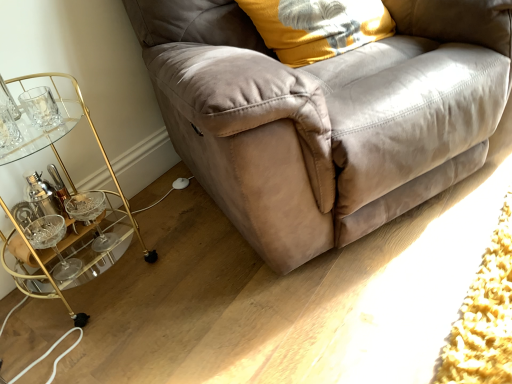
Locate an element on the screen. soft yellow fabric pillow at upper right is located at coordinates (317, 27).

This screenshot has height=384, width=512. Describe the element at coordinates (326, 116) in the screenshot. I see `suede couch at center` at that location.

Locate an element on the screen. The image size is (512, 384). soft yellow fabric pillow at upper right is located at coordinates (317, 27).

What's the angular difference between gold metallic bar cart at left and soft yellow fabric pillow at upper right's facing directions?

The angle between the facing direction of gold metallic bar cart at left and the facing direction of soft yellow fabric pillow at upper right is 25.6 degrees.

Who is smaller, gold metallic bar cart at left or soft yellow fabric pillow at upper right?

With smaller size is soft yellow fabric pillow at upper right.

From a real-world perspective, which is physically below, gold metallic bar cart at left or soft yellow fabric pillow at upper right?

gold metallic bar cart at left, from a real-world perspective.

Is gold metallic bar cart at left oriented towards soft yellow fabric pillow at upper right?

No.

The width and height of the screenshot is (512, 384). In order to click on pillow above the gold metallic bar cart at left (from a real-world perspective) in this screenshot , I will do `click(317, 27)`.

Considering the sizes of objects soft yellow fabric pillow at upper right and gold metallic bar cart at left in the image provided, who is shorter, soft yellow fabric pillow at upper right or gold metallic bar cart at left?

With less height is soft yellow fabric pillow at upper right.

How different are the orientations of soft yellow fabric pillow at upper right and gold metallic bar cart at left in degrees?

25.6 degrees.

From the image's perspective, is soft yellow fabric pillow at upper right under gold metallic bar cart at left?

Incorrect, from the image's perspective, soft yellow fabric pillow at upper right is higher than gold metallic bar cart at left.

Find the location of a particular element. studio couch located above the gold metallic bar cart at left (from the image's perspective) is located at coordinates (326, 116).

In the scene shown: Is suede couch at center spatially inside gold metallic bar cart at left, or outside of it?

suede couch at center is located beyond the bounds of gold metallic bar cart at left.

Who is bigger, suede couch at center or gold metallic bar cart at left?

suede couch at center is bigger.

Can you tell me how much suede couch at center and gold metallic bar cart at left differ in facing direction?

24.4 degrees.

From the image's perspective, relative to suede couch at center, is gold metallic bar cart at left above or below?

Clearly, from the image's perspective, gold metallic bar cart at left is below suede couch at center.

Between gold metallic bar cart at left and suede couch at center, which one appears on the right side from the viewer's perspective?

suede couch at center is more to the right.

Is gold metallic bar cart at left shorter than suede couch at center?

Yes.

Does point (93, 248) come behind point (453, 36)?

That is True.

Is suede couch at center not close to soft yellow fabric pillow at upper right?

Actually, suede couch at center and soft yellow fabric pillow at upper right are a little close together.

From the image's perspective, is suede couch at center under soft yellow fabric pillow at upper right?

Yes, from the image's perspective, suede couch at center is below soft yellow fabric pillow at upper right.

Between suede couch at center and soft yellow fabric pillow at upper right, which one has smaller width?

Thinner between the two is soft yellow fabric pillow at upper right.

From a real-world perspective, is suede couch at center above or below soft yellow fabric pillow at upper right?

suede couch at center is below soft yellow fabric pillow at upper right.

Is point (284, 60) farther from camera compared to point (219, 181)?

Yes, point (284, 60) is farther from viewer.

Based on their sizes in the image, would you say soft yellow fabric pillow at upper right is bigger or smaller than suede couch at center?

Clearly, soft yellow fabric pillow at upper right is smaller in size than suede couch at center.

Is soft yellow fabric pillow at upper right spatially inside suede couch at center, or outside of it?

soft yellow fabric pillow at upper right is spatially positioned inside suede couch at center.

Based on the photo, is soft yellow fabric pillow at upper right wider than suede couch at center?

Incorrect, the width of soft yellow fabric pillow at upper right does not surpass that of suede couch at center.

Find the location of a particular element. This screenshot has width=512, height=384. pillow lying behind the gold metallic bar cart at left is located at coordinates (317, 27).

The image size is (512, 384). Find the location of `pillow that appears above the gold metallic bar cart at left (from the image's perspective)`. pillow that appears above the gold metallic bar cart at left (from the image's perspective) is located at coordinates (317, 27).

In the scene shown: Considering their positions, is soft yellow fabric pillow at upper right positioned closer to suede couch at center than gold metallic bar cart at left?

Based on the image, soft yellow fabric pillow at upper right appears to be nearer to suede couch at center.

When comparing their distances from soft yellow fabric pillow at upper right, does gold metallic bar cart at left or suede couch at center seem closer?

suede couch at center is positioned closer to the anchor soft yellow fabric pillow at upper right.

Based on the photo, from the image, which object appears to be nearer to suede couch at center, gold metallic bar cart at left or soft yellow fabric pillow at upper right?

soft yellow fabric pillow at upper right lies closer to suede couch at center than the other object.

Estimate the real-world distances between objects in this image. Which object is further from gold metallic bar cart at left, suede couch at center or soft yellow fabric pillow at upper right?

soft yellow fabric pillow at upper right lies further to gold metallic bar cart at left than the other object.

Looking at the image, which one is located further to gold metallic bar cart at left, soft yellow fabric pillow at upper right or suede couch at center?

The object further to gold metallic bar cart at left is soft yellow fabric pillow at upper right.

When comparing their distances from soft yellow fabric pillow at upper right, does suede couch at center or gold metallic bar cart at left seem closer?

suede couch at center is closer to soft yellow fabric pillow at upper right.

Locate an element on the screen. Image resolution: width=512 pixels, height=384 pixels. pillow between gold metallic bar cart at left and suede couch at center from left to right is located at coordinates pyautogui.click(x=317, y=27).